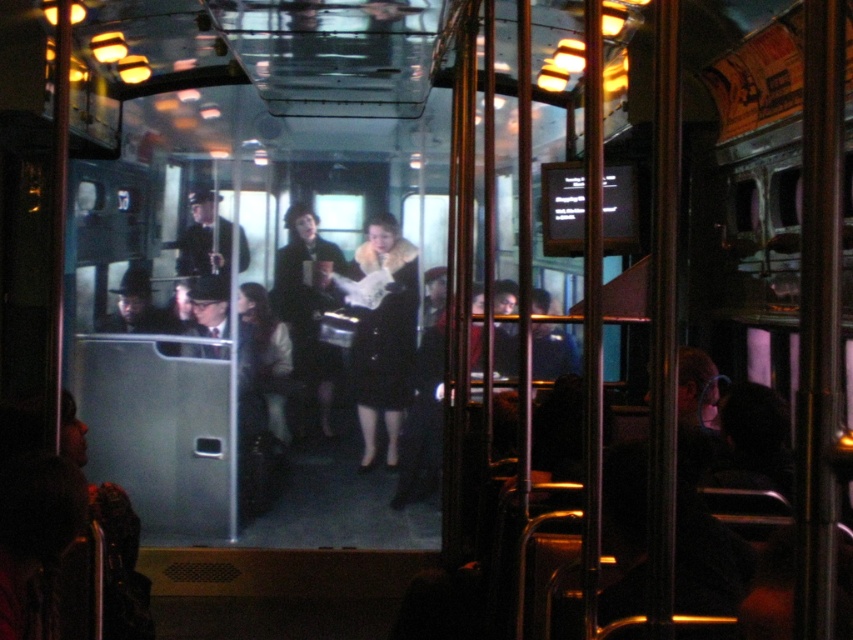
Is matte black coat at center positioned in front of uniformed dark coat at center?

No.

Who is positioned more to the right, matte black coat at center or uniformed dark coat at center?

From the viewer's perspective, matte black coat at center appears more on the right side.

Describe the element at coordinates (265, 355) in the screenshot. Image resolution: width=853 pixels, height=640 pixels. I see `matte black coat at center` at that location.

The height and width of the screenshot is (640, 853). Identify the location of matte black coat at center. (265, 355).

Does black velvet coat at center appear on the left side of uniformed dark coat at center?

No, black velvet coat at center is not to the left of uniformed dark coat at center.

Can you confirm if black velvet coat at center is shorter than uniformed dark coat at center?

No.

Between point (381, 256) and point (242, 243), which one is positioned in front?

Point (242, 243) is in front.

This screenshot has width=853, height=640. Find the location of `black velvet coat at center`. black velvet coat at center is located at coordinates (384, 337).

Is the position of black velvet coat at center more distant than that of matte black coat at center?

That is True.

Which is more to the left, black velvet coat at center or matte black coat at center?

matte black coat at center

Is point (415, 326) closer to camera compared to point (254, 339)?

No, it is behind (254, 339).

Identify the location of black velvet coat at center. This screenshot has width=853, height=640. (384, 337).